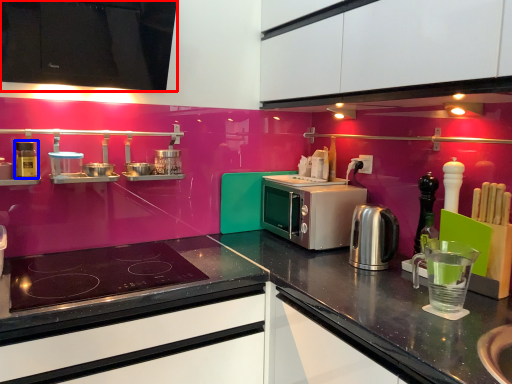
Question: Among these objects, which one is farthest to the camera, cabinetry (highlighted by a red box) or appliance (highlighted by a blue box)?

Choices:
 (A) cabinetry
 (B) appliance

Answer: (B)